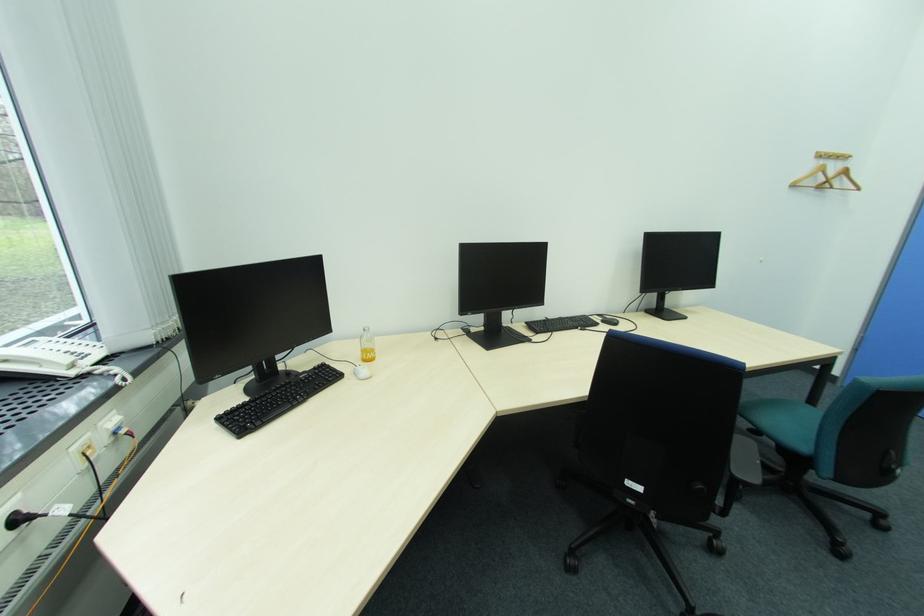
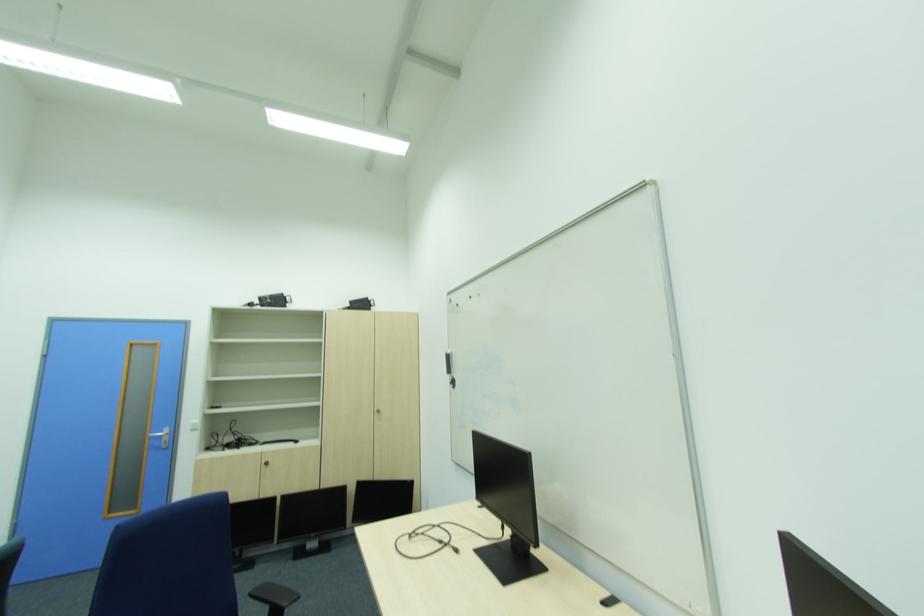
Question: The camera is either moving clockwise (left) or counter-clockwise (right) around the object. The first image is from the beginning of the video and the second image is from the end. Is the camera moving left or right when shooting the video?

Choices:
 (A) Left
 (B) Right

Answer: (A)